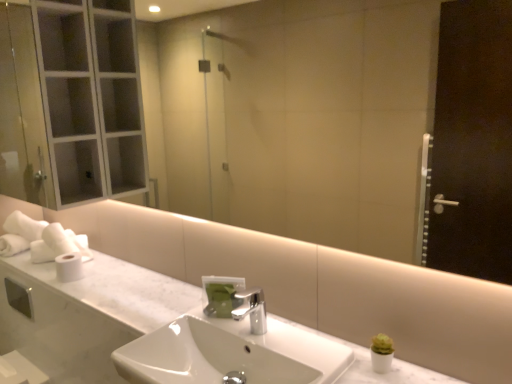
The height and width of the screenshot is (384, 512). In order to click on vacant space in front of green matte soap dispenser at center in this screenshot , I will do `click(232, 332)`.